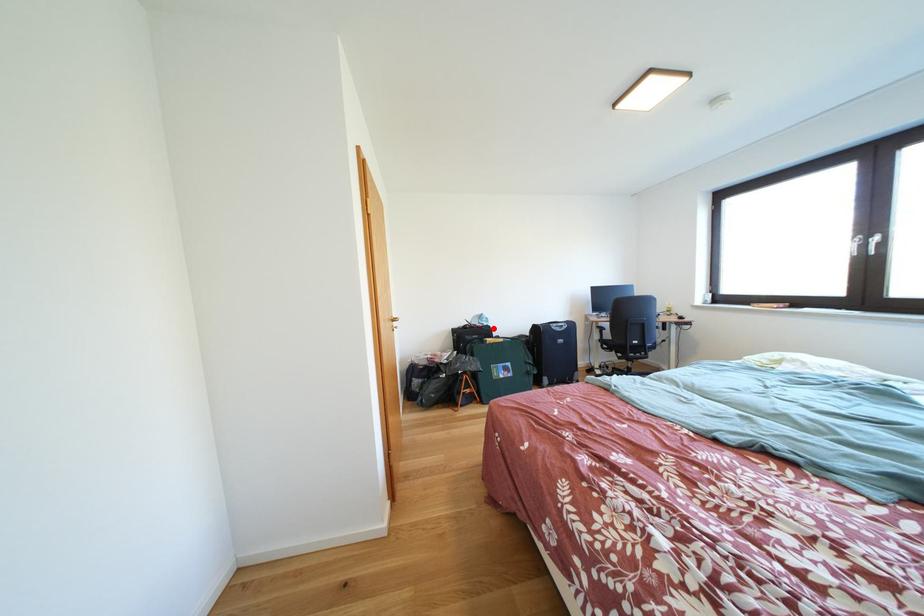
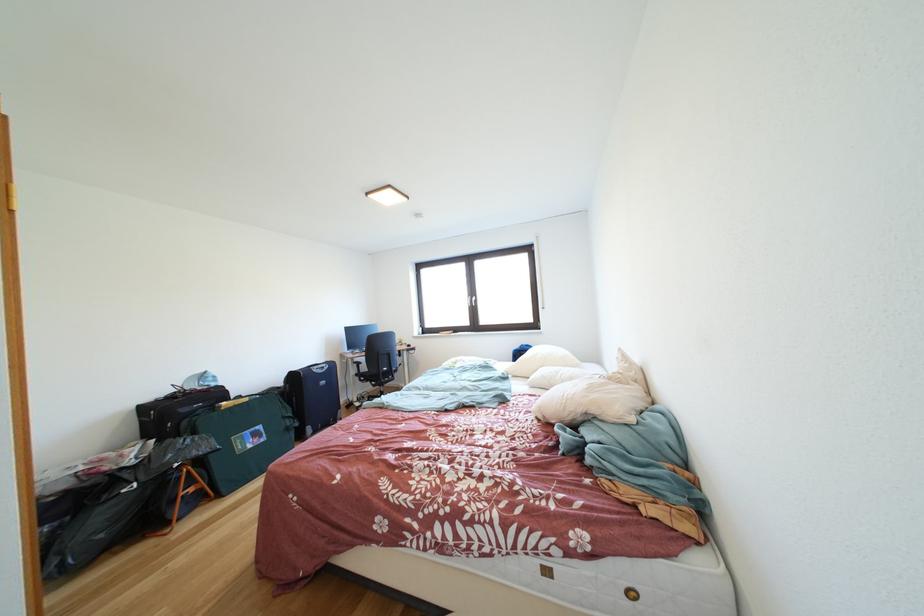
Find the pixel in the second image that matches the highlighted location in the first image.

(222, 389)